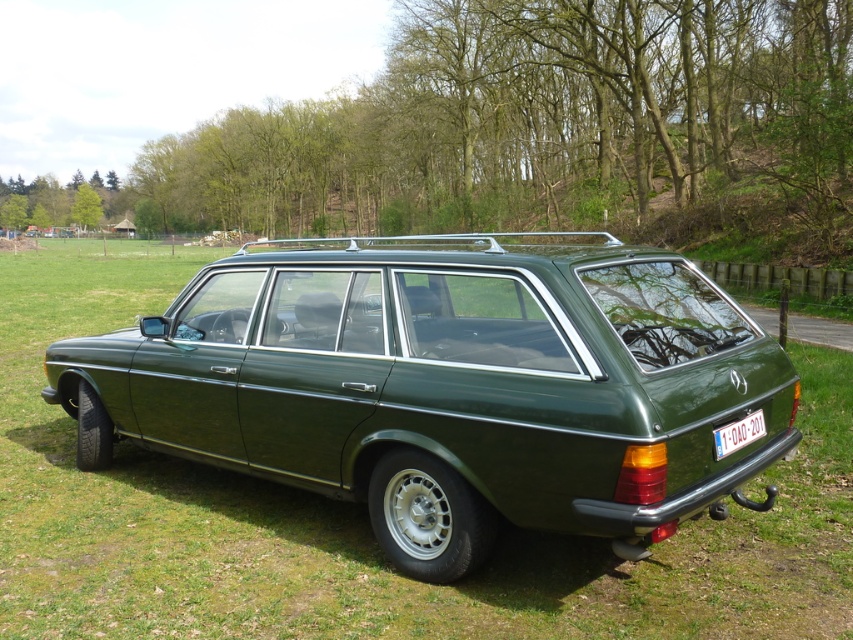
Which is more to the left, green matte station wagon at center or white plastic license plate at lower right?

green matte station wagon at center is more to the left.

Is the position of green matte station wagon at center less distant than that of white plastic license plate at lower right?

Yes, green matte station wagon at center is closer to the viewer.

Is point (405, 348) closer to camera compared to point (729, 428)?

No, (405, 348) is further to viewer.

The image size is (853, 640). Identify the location of green matte station wagon at center. (448, 385).